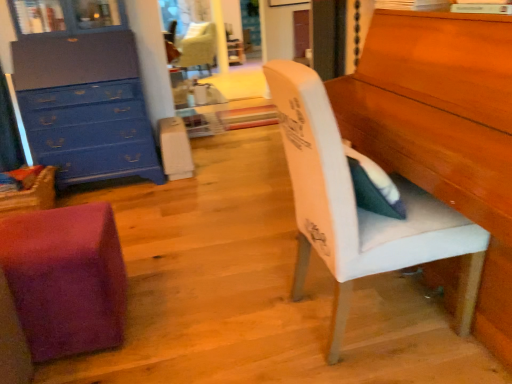
This screenshot has height=384, width=512. I want to click on free spot to the left of white fabric chair at right, positioned as the first chair in front-to-back order, so click(233, 313).